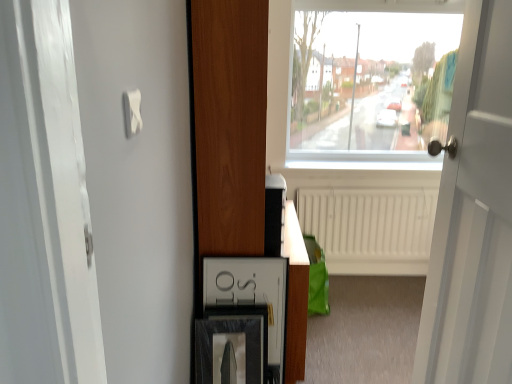
This screenshot has width=512, height=384. I want to click on vacant space underneath white matte radiator at center (from a real-world perspective), so pyautogui.click(x=373, y=282).